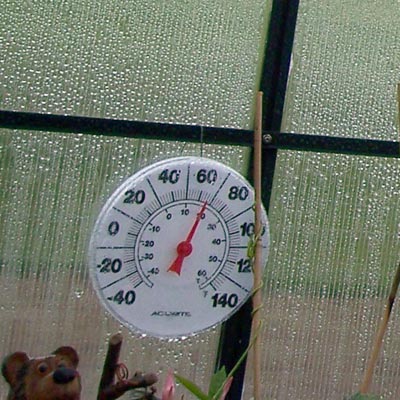
Find the location of a particular element. thermometer is located at coordinates (165, 207).